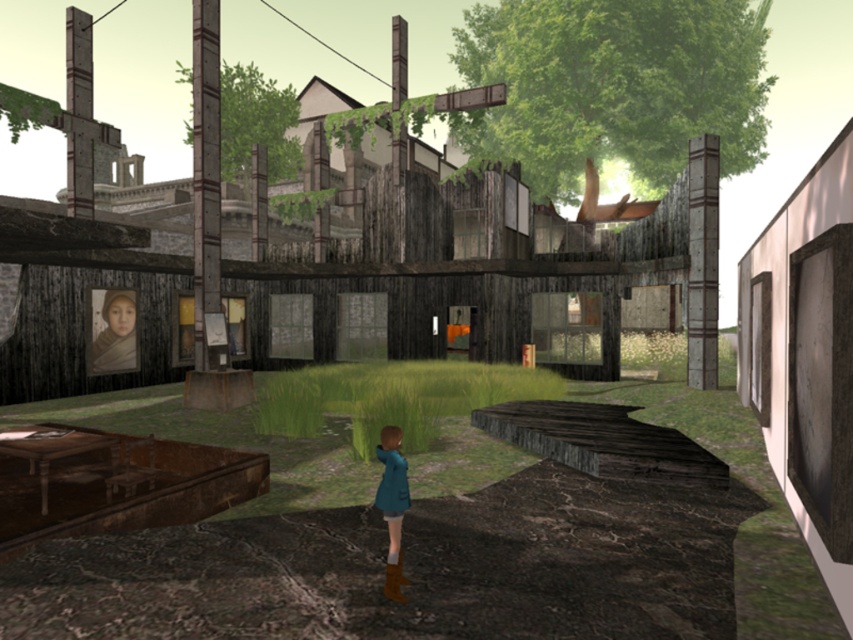
Question: Is matte brown hair at upper left below matte brown dress at upper left?

Choices:
 (A) yes
 (B) no

Answer: (B)

Question: Which of the following is the closest to the observer?

Choices:
 (A) matte brown dress at upper left
 (B) teal fabric coat at center

Answer: (B)

Question: Does matte brown hair at upper left appear on the right side of matte brown dress at upper left?

Choices:
 (A) yes
 (B) no

Answer: (A)

Question: Is teal fabric dress at center positioned before matte brown dress at upper left?

Choices:
 (A) yes
 (B) no

Answer: (A)

Question: Which of the following is the closest to the observer?

Choices:
 (A) teal fabric dress at center
 (B) teal fabric coat at center

Answer: (B)

Question: Among these points, which one is nearest to the camera?

Choices:
 (A) (380, 445)
 (B) (111, 348)
 (C) (393, 550)
 (D) (96, 348)

Answer: (C)